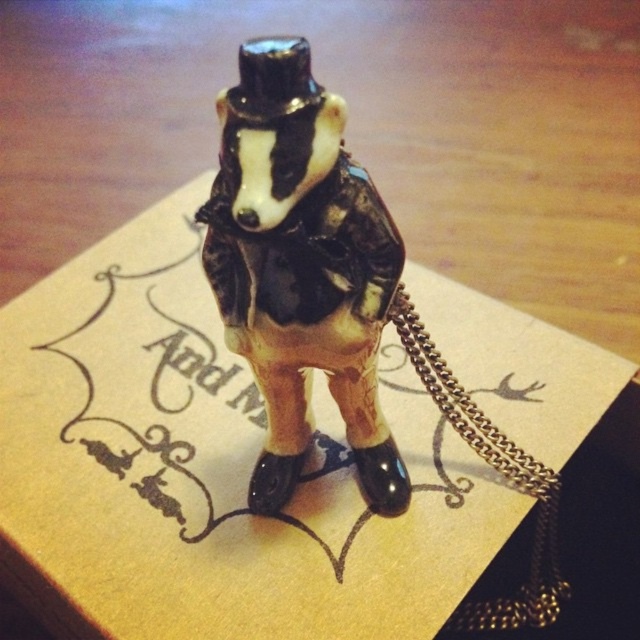
Measure the distance from porcelain badger at center to gold chain at lower right.

porcelain badger at center and gold chain at lower right are 5.88 inches apart.

Is porcelain badger at center smaller than gold chain at lower right?

No.

Locate an element on the screen. The image size is (640, 640). porcelain badger at center is located at coordinates (301, 268).